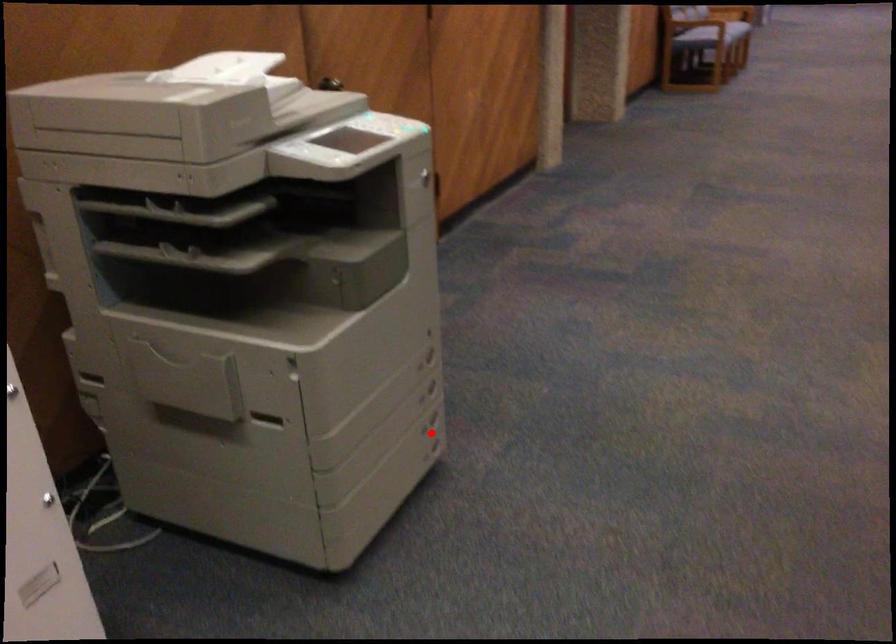
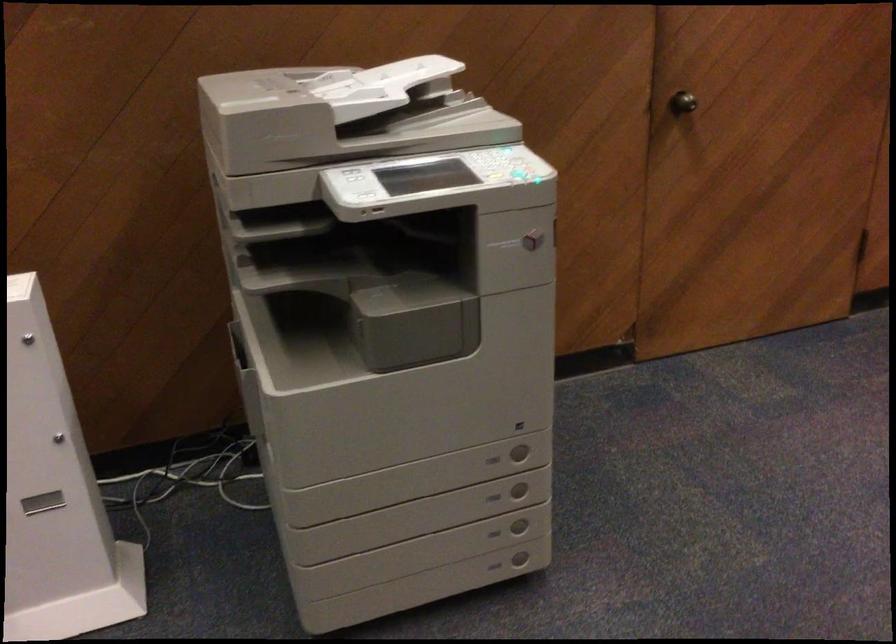
In the second image, find the point that corresponds to the highlighted location in the first image.

(494, 533)